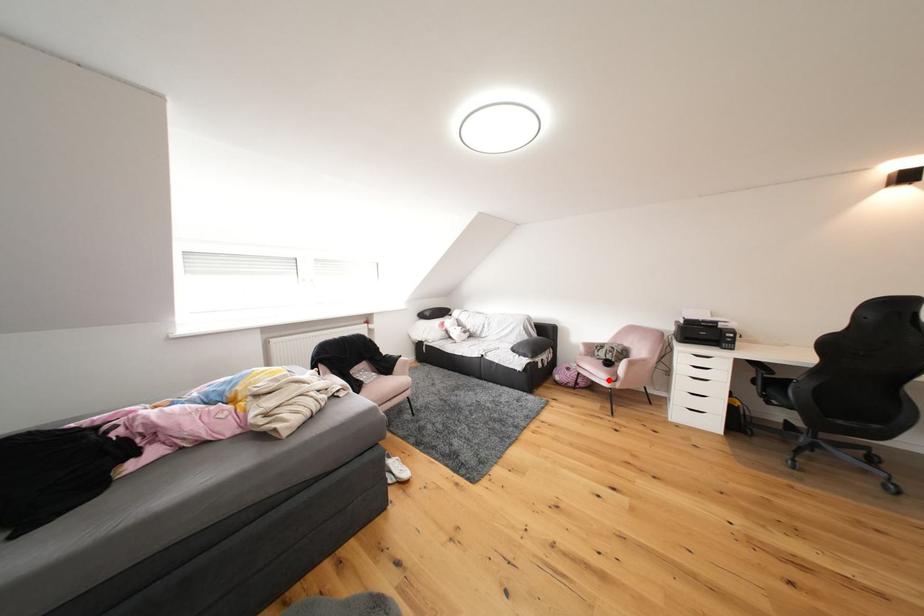
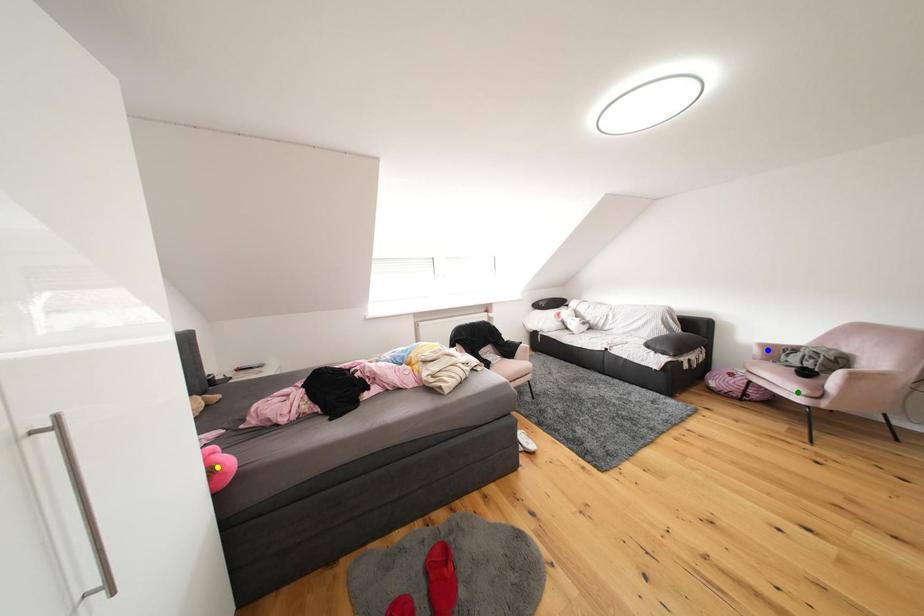
Question: I am providing you with two images of the same scene from different viewpoints. A red point is marked on the first image. You are given multiple points on the second image. Which mark in image 2 goes with the point in image 1?

Choices:
 (A) green point
 (B) blue point
 (C) yellow point

Answer: (A)